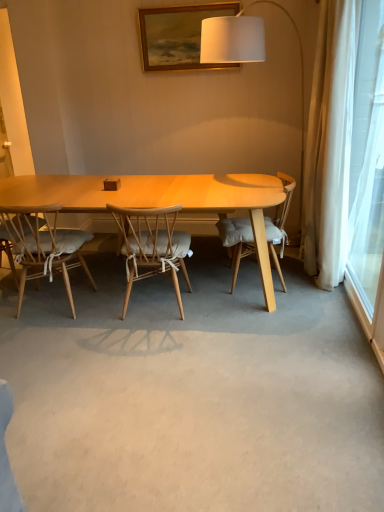
Question: Can you confirm if natural wood chair with cushion at center, which is the 2th chair from right to left, is smaller than light wood chair with cushion at center, the 1th chair positioned from the right?

Choices:
 (A) yes
 (B) no

Answer: (A)

Question: Does natural wood chair with cushion at center, the 2th chair in the left-to-right sequence, turn towards light wood chair with cushion at center, the 3th chair in the left-to-right sequence?

Choices:
 (A) yes
 (B) no

Answer: (B)

Question: Is natural wood chair with cushion at center, which is the 2th chair from right to left, outside light wood chair with cushion at center, the 1th chair positioned from the right?

Choices:
 (A) yes
 (B) no

Answer: (A)

Question: From the image's perspective, is natural wood chair with cushion at center, which is the 2th chair from right to left, located above light wood chair with cushion at center, the 1th chair positioned from the right?

Choices:
 (A) no
 (B) yes

Answer: (A)

Question: Is natural wood chair with cushion at center, the 2th chair in the left-to-right sequence, placed right next to light wood chair with cushion at center, the 1th chair positioned from the right?

Choices:
 (A) no
 (B) yes

Answer: (A)

Question: In terms of height, does white fabric lampshade at upper center look taller or shorter compared to light wood chair with white cushion at left, which is the first chair in left-to-right order?

Choices:
 (A) tall
 (B) short

Answer: (A)

Question: Does point pyautogui.click(x=264, y=219) appear closer or farther from the camera than point pyautogui.click(x=23, y=263)?

Choices:
 (A) closer
 (B) farther

Answer: (B)

Question: Is white fabric lampshade at upper center in front of or behind light wood chair with white cushion at left, which is the first chair in left-to-right order, in the image?

Choices:
 (A) front
 (B) behind

Answer: (B)

Question: Is white fabric lampshade at upper center situated inside light wood chair with white cushion at left, which is the first chair in left-to-right order, or outside?

Choices:
 (A) outside
 (B) inside

Answer: (A)

Question: In terms of width, does white fabric lampshade at upper center look wider or thinner when compared to natural wood chair with cushion at center, the 2th chair in the left-to-right sequence?

Choices:
 (A) thin
 (B) wide

Answer: (A)

Question: Relative to natural wood chair with cushion at center, which is the 2th chair from right to left, is white fabric lampshade at upper center in front or behind?

Choices:
 (A) behind
 (B) front

Answer: (A)

Question: Is white fabric lampshade at upper center situated inside natural wood chair with cushion at center, the 2th chair in the left-to-right sequence, or outside?

Choices:
 (A) inside
 (B) outside

Answer: (B)

Question: From the image's perspective, is white fabric lampshade at upper center above or below natural wood chair with cushion at center, which is the 2th chair from right to left?

Choices:
 (A) below
 (B) above

Answer: (B)

Question: From a real-world perspective, is transparent glass window at right positioned above or below white fabric lampshade at upper center?

Choices:
 (A) below
 (B) above

Answer: (B)

Question: From the image's perspective, relative to white fabric lampshade at upper center, is transparent glass window at right above or below?

Choices:
 (A) above
 (B) below

Answer: (B)